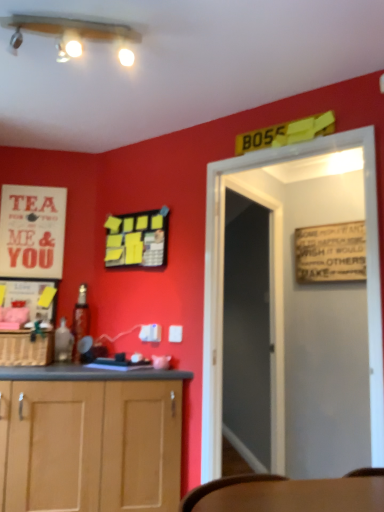
Question: Should I look upward or downward to see matte white lights at upper center?

Choices:
 (A) down
 (B) up

Answer: (B)

Question: Would you consider transparent glass door at center to be distant from metallic glass bottle at left, acting as the 2th bottle starting from the front?

Choices:
 (A) yes
 (B) no

Answer: (A)

Question: Is transparent glass door at center facing towards metallic glass bottle at left, acting as the 2th bottle starting from the front?

Choices:
 (A) no
 (B) yes

Answer: (A)

Question: Considering the relative sizes of transparent glass door at center and metallic glass bottle at left, which is the first bottle from back to front, in the image provided, is transparent glass door at center bigger than metallic glass bottle at left, which is the first bottle from back to front,?

Choices:
 (A) yes
 (B) no

Answer: (A)

Question: Is transparent glass door at center with metallic glass bottle at left, which is the first bottle from back to front?

Choices:
 (A) no
 (B) yes

Answer: (A)

Question: Is transparent glass door at center positioned with its back to metallic glass bottle at left, acting as the 2th bottle starting from the front?

Choices:
 (A) yes
 (B) no

Answer: (A)

Question: Considering the relative sizes of transparent glass door at center and metallic glass bottle at left, which is the first bottle from back to front, in the image provided, is transparent glass door at center wider than metallic glass bottle at left, which is the first bottle from back to front,?

Choices:
 (A) no
 (B) yes

Answer: (A)

Question: Can you confirm if white wooden door at center is positioned to the right of translucent glass bottle at lower left, which is the second bottle from back to front?

Choices:
 (A) yes
 (B) no

Answer: (A)

Question: Is white wooden door at center oriented away from translucent glass bottle at lower left, the first bottle positioned from the front?

Choices:
 (A) no
 (B) yes

Answer: (A)

Question: Does white wooden door at center appear on the left side of translucent glass bottle at lower left, the first bottle positioned from the front?

Choices:
 (A) no
 (B) yes

Answer: (A)

Question: From the image's perspective, is white wooden door at center located above translucent glass bottle at lower left, the first bottle positioned from the front?

Choices:
 (A) no
 (B) yes

Answer: (B)

Question: Considering the relative sizes of white wooden door at center and translucent glass bottle at lower left, the first bottle positioned from the front, in the image provided, is white wooden door at center smaller than translucent glass bottle at lower left, the first bottle positioned from the front,?

Choices:
 (A) yes
 (B) no

Answer: (B)

Question: Could you tell me if white wooden door at center is facing translucent glass bottle at lower left, the first bottle positioned from the front?

Choices:
 (A) no
 (B) yes

Answer: (A)

Question: Is woven brown basket at lower left shorter than white paper poster at upper left?

Choices:
 (A) yes
 (B) no

Answer: (A)